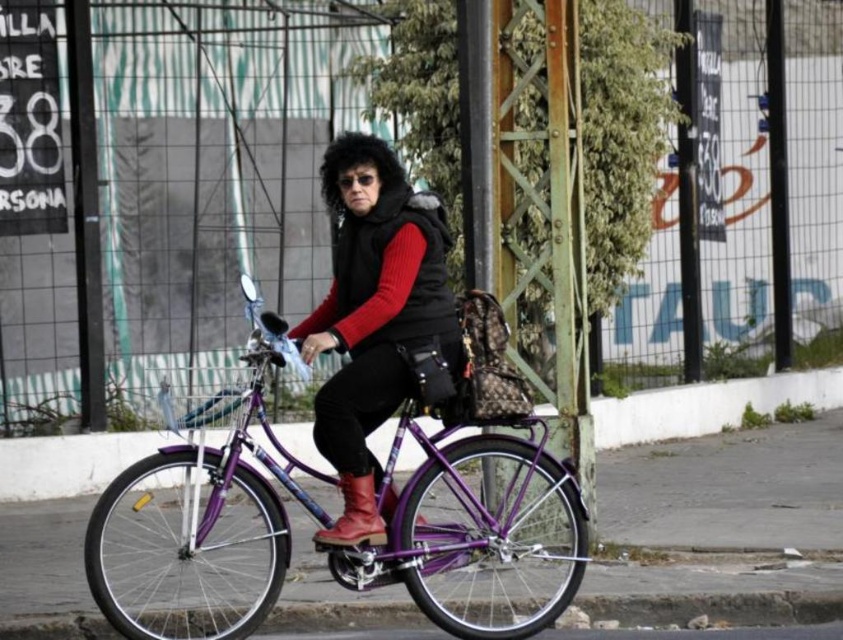
Which is behind, point (362, 452) or point (345, 512)?

The point (345, 512) is more distant.

Who is positioned more to the right, matte black vest at center or leather boot at center?

From the viewer's perspective, matte black vest at center appears more on the right side.

Who is more distant from viewer, (432, 316) or (364, 513)?

Point (432, 316)

Locate an element on the screen. This screenshot has height=640, width=843. matte black vest at center is located at coordinates (374, 316).

Is purple metallic bicycle at center positioned in front of matte black vest at center?

Yes.

This screenshot has width=843, height=640. What do you see at coordinates (200, 516) in the screenshot? I see `purple metallic bicycle at center` at bounding box center [200, 516].

Which is in front, point (476, 534) or point (337, 472)?

Positioned in front is point (476, 534).

At what (x,y) coordinates should I click in order to perform the action: click on purple metallic bicycle at center. Please return your answer as a coordinate pair (x, y). Image resolution: width=843 pixels, height=640 pixels. Looking at the image, I should click on (200, 516).

Is purple metallic bicycle at center taller than leather boot at center?

Yes, purple metallic bicycle at center is taller than leather boot at center.

Is point (455, 596) positioned after point (369, 531)?

That is True.

Which is behind, point (127, 596) or point (344, 483)?

Positioned behind is point (127, 596).

The width and height of the screenshot is (843, 640). In order to click on purple metallic bicycle at center in this screenshot , I will do `click(200, 516)`.